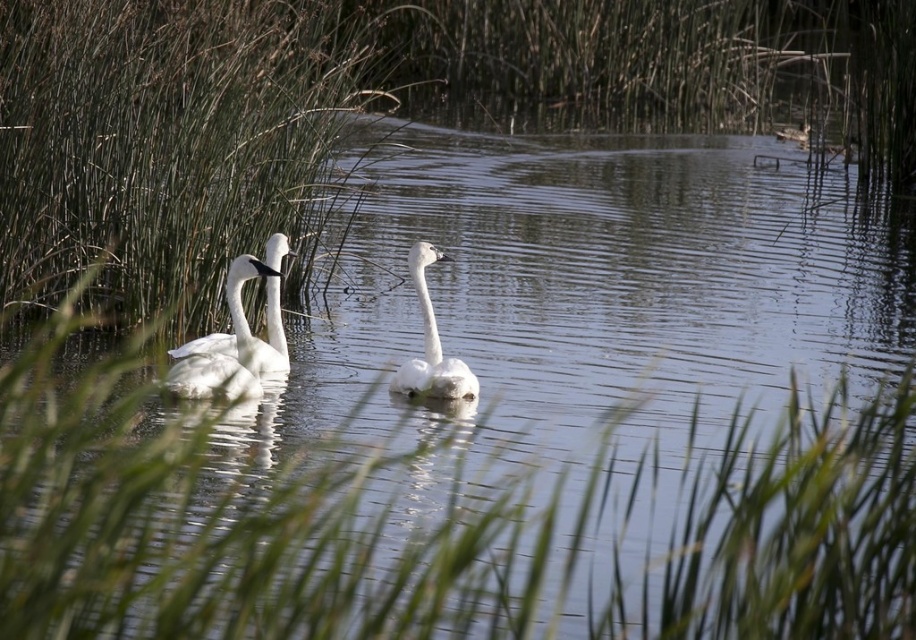
Between white glossy swan at left and white matte swan at center, which one appears on the right side from the viewer's perspective?

white matte swan at center

Looking at this image, which is below, white glossy swan at left or white matte swan at center?

white matte swan at center is lower down.

Which is in front, point (259, 348) or point (418, 282)?

Point (259, 348)

At what (x,y) coordinates should I click in order to perform the action: click on white glossy swan at left. Please return your answer as a coordinate pair (x, y). Looking at the image, I should click on (244, 316).

Can you confirm if green grass at upper left is positioned above white matte swan at center?

Yes, green grass at upper left is above white matte swan at center.

Which is in front, point (42, 241) or point (431, 362)?

Point (431, 362) is in front.

You are a GUI agent. You are given a task and a screenshot of the screen. Output one action in this format:
    pyautogui.click(x=<x>, y=<y>)
    Task: Click on the green grass at upper left
    This screenshot has height=640, width=916.
    Given the screenshot: What is the action you would take?
    pyautogui.click(x=166, y=141)

Who is more forward, [96,196] or [184,353]?

Positioned in front is point [184,353].

Find the location of a particular element. The height and width of the screenshot is (640, 916). green grass at upper left is located at coordinates (166, 141).

Image resolution: width=916 pixels, height=640 pixels. What are the coordinates of `green grass at upper left` in the screenshot? It's located at (166, 141).